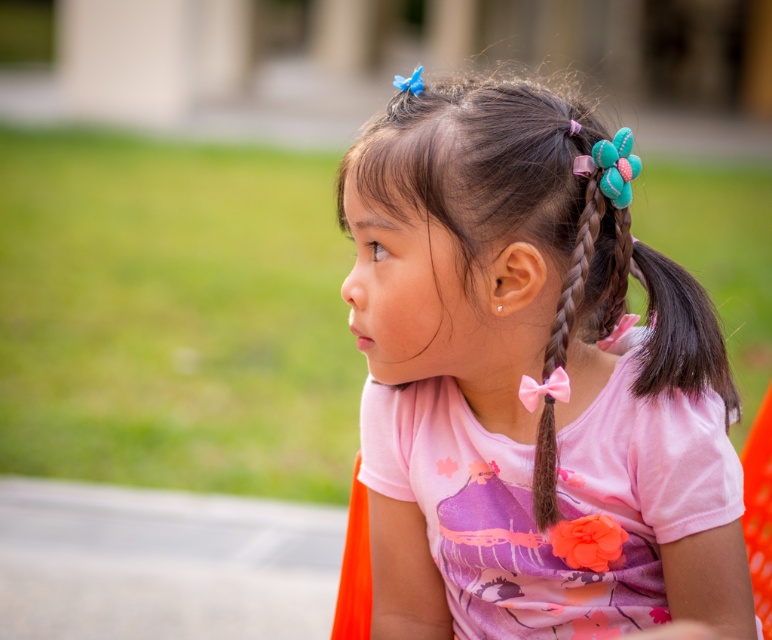
You are a tailor who needs to determine which item is taller between the pink fabric shirt at center and the pink satin ribbon at right. Based on the scene, which one has a greater height?

The pink fabric shirt at center has a greater height compared to the pink satin ribbon at right.

You are an artist trying to sketch the girl in the image. You want to place the pink fabric shirt at center correctly. According to the coordinates given, where should you position the shirt on a canvas divided into a grid from 0 to 1 on both axes?

The pink fabric shirt at center should be positioned at the coordinates 0.603 on the x axis and 0.689 on the y axis, as specified in the description.